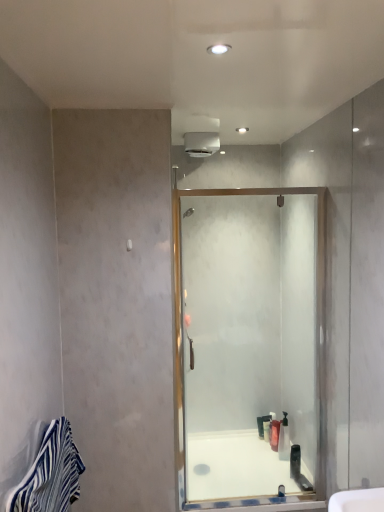
Question: Considering the positions of point (279, 428) and point (269, 420), is point (279, 428) closer or farther from the camera than point (269, 420)?

Choices:
 (A) closer
 (B) farther

Answer: (A)

Question: Looking at the image, does translucent plastic bottle at center, marked as the second toiletry in a front-to-back arrangement, seem bigger or smaller compared to translucent plastic bottle at lower center, which ranks as the 3th toiletry in front-to-back order?

Choices:
 (A) small
 (B) big

Answer: (B)

Question: Which is farther from the translucent plastic bottle at center, the second toiletry positioned from the back?

Choices:
 (A) translucent plastic bottle at lower center, which ranks as the 1th toiletry in back-to-front order
 (B) clear glass shower door at center
 (C) blue striped towel at lower left
 (D) translucent plastic soap dispenser at center, which is the first toiletry in front-to-back order
 (E) white glossy bath at center

Answer: (C)

Question: Estimate the real-world distances between objects in this image. Which object is farther from the clear glass shower door at center?

Choices:
 (A) translucent plastic bottle at lower center, which ranks as the 1th toiletry in back-to-front order
 (B) translucent plastic bottle at center, the second toiletry positioned from the back
 (C) white glossy bath at center
 (D) translucent plastic soap dispenser at center, which is the first toiletry in front-to-back order
 (E) blue striped towel at lower left

Answer: (E)